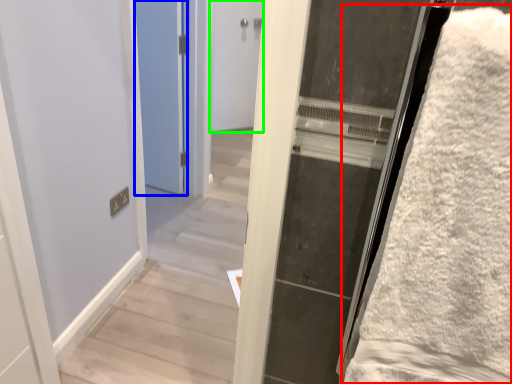
Question: Which object is the farthest from bath towel (highlighted by a red box)? Choose among these: door (highlighted by a blue box) or door (highlighted by a green box).

Choices:
 (A) door
 (B) door

Answer: (B)